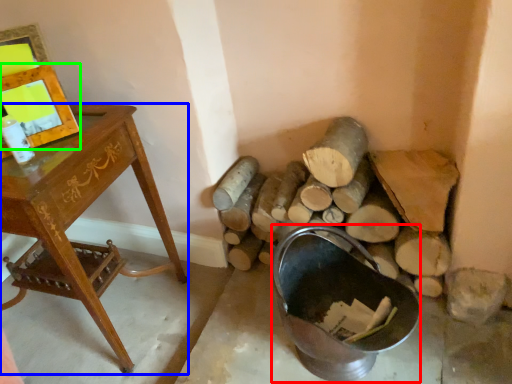
Question: Which object is positioned farthest from basin (highlighted by a red box)? Select from desk (highlighted by a blue box) and picture frame (highlighted by a green box).

Choices:
 (A) desk
 (B) picture frame

Answer: (B)